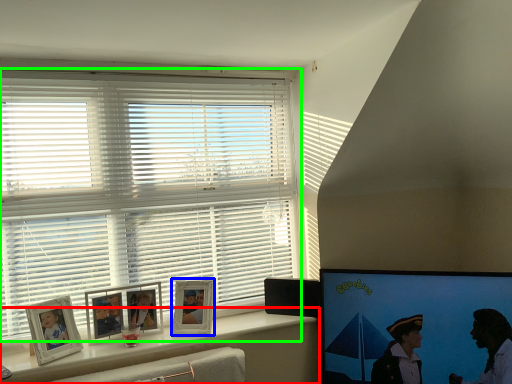
Question: Estimate the real-world distances between objects in this image. Which object is farther from window sill (highlighted by a red box), picture frame (highlighted by a blue box) or window blind (highlighted by a green box)?

Choices:
 (A) picture frame
 (B) window blind

Answer: (B)